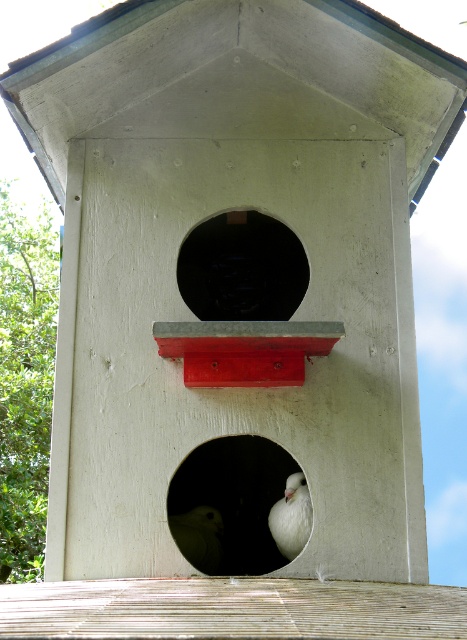
Question: Which of the following is the closest to the observer?

Choices:
 (A) (241, 230)
 (B) (198, 556)
 (C) (226, 456)
 (D) (288, 513)

Answer: (D)

Question: Is white matte/porcelain hole at center below white matte bird at lower center?

Choices:
 (A) no
 (B) yes

Answer: (A)

Question: Based on their relative distances, which object is nearer to the white matte bird at center?

Choices:
 (A) white matte/porcelain hole at center
 (B) white matte bird at lower center
 (C) black matte hole at center

Answer: (B)

Question: Does black matte hole at center lie behind white matte bird at lower center?

Choices:
 (A) no
 (B) yes

Answer: (B)

Question: Which point is closer to the camera?

Choices:
 (A) (176, 520)
 (B) (249, 307)

Answer: (A)

Question: Is white matte/porcelain hole at center positioned behind white matte bird at center?

Choices:
 (A) no
 (B) yes

Answer: (B)